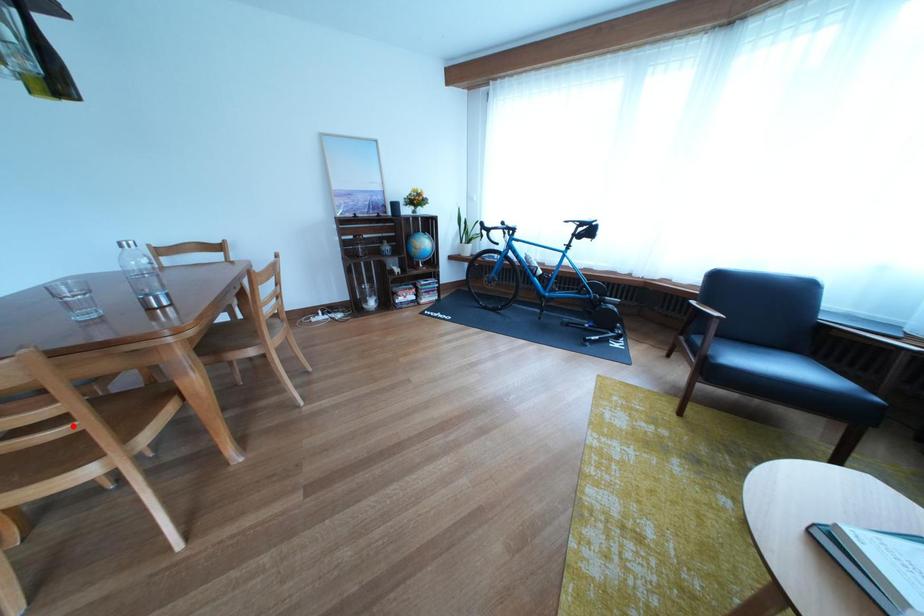
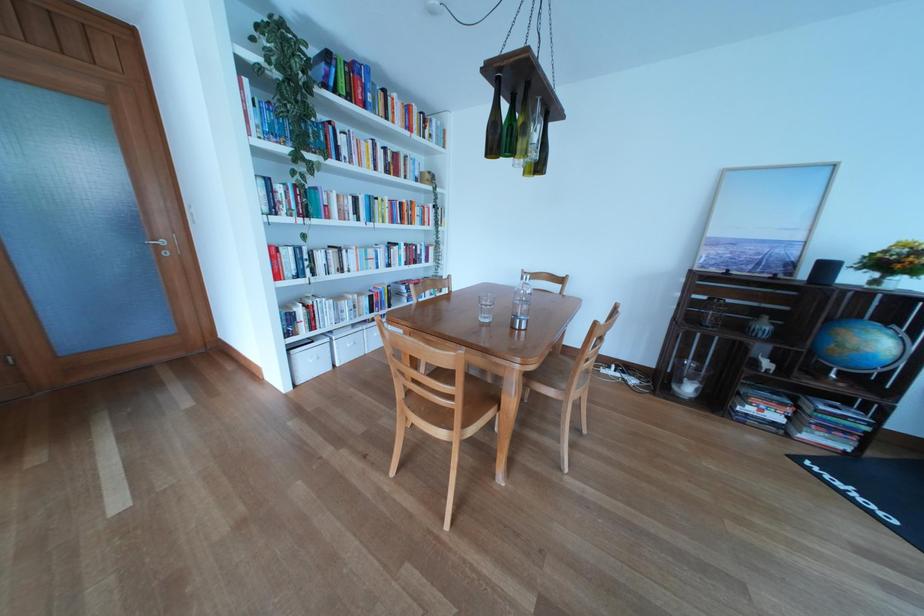
Find the pixel in the second image that matches the highlighted location in the first image.

(464, 403)